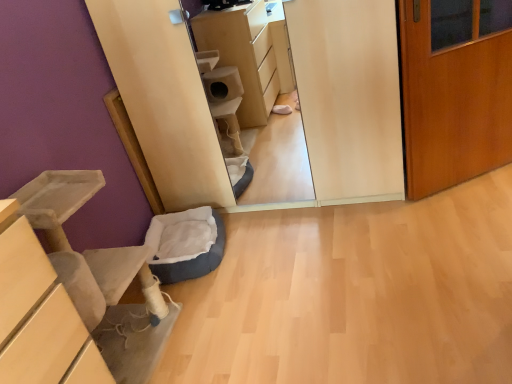
This screenshot has height=384, width=512. Describe the element at coordinates (57, 200) in the screenshot. I see `soft gray cat bed at lower left` at that location.

What is the approximate width of wooden door at right?

wooden door at right is 2.82 inches wide.

This screenshot has height=384, width=512. What are the coordinates of `soft gray cat bed at lower left` in the screenshot? It's located at (57, 200).

From a real-world perspective, is soft gray cat bed at lower left below dark blue plush cat bed at lower left?

No, from a real-world perspective, soft gray cat bed at lower left is not below dark blue plush cat bed at lower left.

Do you think soft gray cat bed at lower left is within dark blue plush cat bed at lower left, or outside of it?

soft gray cat bed at lower left is located beyond the bounds of dark blue plush cat bed at lower left.

Which of these two, soft gray cat bed at lower left or dark blue plush cat bed at lower left, is thinner?

soft gray cat bed at lower left.

Is soft gray cat bed at lower left to the left or to the right of dark blue plush cat bed at lower left in the image?

From the image, it's evident that soft gray cat bed at lower left is to the left of dark blue plush cat bed at lower left.

Considering the sizes of objects wooden door at right and dark blue plush cat bed at lower left in the image provided, who is wider, wooden door at right or dark blue plush cat bed at lower left?

With larger width is dark blue plush cat bed at lower left.

Which is less distant, (492, 144) or (205, 266)?

Point (492, 144).

From a real-world perspective, is wooden door at right positioned under dark blue plush cat bed at lower left based on gravity?

No, from a real-world perspective, wooden door at right is not under dark blue plush cat bed at lower left.

Between wooden door at right and dark blue plush cat bed at lower left, which one appears on the right side from the viewer's perspective?

wooden door at right is more to the right.

From a real-world perspective, relative to soft gray cat bed at lower left, is wooden door at right vertically above or below?

wooden door at right is above soft gray cat bed at lower left.

From the image's perspective, which one is positioned lower, wooden door at right or soft gray cat bed at lower left?

soft gray cat bed at lower left appears lower in the image.

Between wooden door at right and soft gray cat bed at lower left, which one has smaller size?

wooden door at right.

Which of these two, wooden door at right or soft gray cat bed at lower left, is wider?

soft gray cat bed at lower left.

Considering the relative positions of dark blue plush cat bed at lower left and wooden door at right in the image provided, is dark blue plush cat bed at lower left to the left or to the right of wooden door at right?

From the image, it's evident that dark blue plush cat bed at lower left is to the left of wooden door at right.

This screenshot has width=512, height=384. Identify the location of cat bed that appears below the wooden door at right (from a real-world perspective). (185, 244).

How different are the orientations of dark blue plush cat bed at lower left and wooden door at right in degrees?

They differ by 71.5 degrees in their facing directions.

Does dark blue plush cat bed at lower left have a lesser height compared to wooden door at right?

Correct, dark blue plush cat bed at lower left is not as tall as wooden door at right.

Locate an element on the screen. This screenshot has height=384, width=512. furniture above the dark blue plush cat bed at lower left (from a real-world perspective) is located at coordinates (57, 200).

Between dark blue plush cat bed at lower left and soft gray cat bed at lower left, which one appears on the left side from the viewer's perspective?

From the viewer's perspective, soft gray cat bed at lower left appears more on the left side.

Which is in front, point (173, 245) or point (162, 306)?

The point (162, 306) is closer to the camera.

Locate an element on the screen. The image size is (512, 384). door above the soft gray cat bed at lower left (from a real-world perspective) is located at coordinates (455, 90).

Does point (106, 280) appear closer or farther from the camera than point (437, 89)?

Point (106, 280) appears to be closer to the viewer than point (437, 89).

Consider the image. Is soft gray cat bed at lower left directly adjacent to wooden door at right?

soft gray cat bed at lower left and wooden door at right are clearly separated.

This screenshot has height=384, width=512. Find the location of `cat bed that appears above the soft gray cat bed at lower left (from the image's perspective)`. cat bed that appears above the soft gray cat bed at lower left (from the image's perspective) is located at coordinates (185, 244).

Locate an element on the screen. Image resolution: width=512 pixels, height=384 pixels. door on the right of dark blue plush cat bed at lower left is located at coordinates (455, 90).

From the image, which object appears to be farther from dark blue plush cat bed at lower left, soft gray cat bed at lower left or wooden door at right?

wooden door at right is further to dark blue plush cat bed at lower left.

Considering their positions, is soft gray cat bed at lower left positioned further to wooden door at right than dark blue plush cat bed at lower left?

soft gray cat bed at lower left lies further to wooden door at right than the other object.

Considering their positions, is dark blue plush cat bed at lower left positioned further to wooden door at right than soft gray cat bed at lower left?

soft gray cat bed at lower left is positioned further to the anchor wooden door at right.

Estimate the real-world distances between objects in this image. Which object is closer to dark blue plush cat bed at lower left, wooden door at right or soft gray cat bed at lower left?

Based on the image, soft gray cat bed at lower left appears to be nearer to dark blue plush cat bed at lower left.

When comparing their distances from soft gray cat bed at lower left, does dark blue plush cat bed at lower left or wooden door at right seem closer?

dark blue plush cat bed at lower left lies closer to soft gray cat bed at lower left than the other object.

Estimate the real-world distances between objects in this image. Which object is further from soft gray cat bed at lower left, wooden door at right or dark blue plush cat bed at lower left?

Among the two, wooden door at right is located further to soft gray cat bed at lower left.

In order to click on cat bed between soft gray cat bed at lower left and wooden door at right in the horizontal direction in this screenshot , I will do `click(185, 244)`.